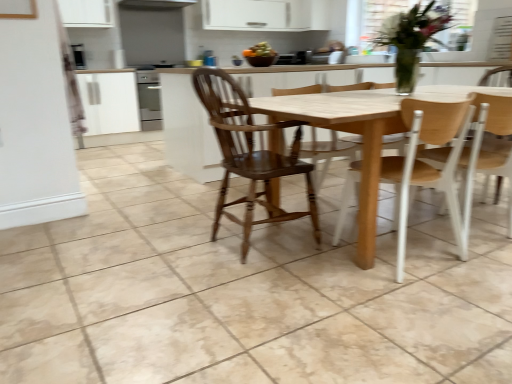
Question: Is light brown wood chair at right, which is counted as the first chair, starting from the right, far away from wooden chair at center, acting as the first chair starting from the left?

Choices:
 (A) no
 (B) yes

Answer: (A)

Question: From a real-world perspective, does light brown wood chair at right, which is counted as the first chair, starting from the right, sit lower than wooden chair at center, which appears as the 3th chair when viewed from the right?

Choices:
 (A) no
 (B) yes

Answer: (B)

Question: Considering the relative positions of light brown wood chair at right, which appears as the third chair when viewed from the left, and wooden chair at center, acting as the first chair starting from the left, in the image provided, is light brown wood chair at right, which appears as the third chair when viewed from the left, behind wooden chair at center, acting as the first chair starting from the left,?

Choices:
 (A) yes
 (B) no

Answer: (A)

Question: Is light brown wood chair at right, which appears as the third chair when viewed from the left, turned away from wooden chair at center, which appears as the 3th chair when viewed from the right?

Choices:
 (A) no
 (B) yes

Answer: (A)

Question: Is light brown wood chair at right, which is counted as the first chair, starting from the right, outside of wooden chair at center, which appears as the 3th chair when viewed from the right?

Choices:
 (A) yes
 (B) no

Answer: (A)

Question: In terms of height, does black glossy microwave at upper left look taller or shorter compared to wooden chair at center, which appears as the 3th chair when viewed from the right?

Choices:
 (A) short
 (B) tall

Answer: (A)

Question: Is black glossy microwave at upper left situated inside wooden chair at center, which appears as the 3th chair when viewed from the right, or outside?

Choices:
 (A) outside
 (B) inside

Answer: (A)

Question: From a real-world perspective, is black glossy microwave at upper left physically located above or below wooden chair at center, which appears as the 3th chair when viewed from the right?

Choices:
 (A) below
 (B) above

Answer: (B)

Question: Is black glossy microwave at upper left wider or thinner than wooden chair at center, acting as the first chair starting from the left?

Choices:
 (A) thin
 (B) wide

Answer: (A)

Question: Is point (456, 152) positioned closer to the camera than point (74, 44)?

Choices:
 (A) farther
 (B) closer

Answer: (B)

Question: Is wooden chair at center, marked as the second chair in a left-to-right arrangement, spatially inside black glossy microwave at upper left, or outside of it?

Choices:
 (A) outside
 (B) inside

Answer: (A)

Question: Looking at the image, does wooden chair at center, which is the 2th chair from right to left, seem bigger or smaller compared to black glossy microwave at upper left?

Choices:
 (A) small
 (B) big

Answer: (B)

Question: In the image, is wooden chair at center, marked as the second chair in a left-to-right arrangement, on the left side or the right side of black glossy microwave at upper left?

Choices:
 (A) left
 (B) right

Answer: (B)

Question: Considering the positions of light brown wood chair at right, which is counted as the first chair, starting from the right, and light wood table at center in the image, is light brown wood chair at right, which is counted as the first chair, starting from the right, taller or shorter than light wood table at center?

Choices:
 (A) short
 (B) tall

Answer: (B)

Question: From a real-world perspective, is light brown wood chair at right, which is counted as the first chair, starting from the right, positioned above or below light wood table at center?

Choices:
 (A) above
 (B) below

Answer: (A)